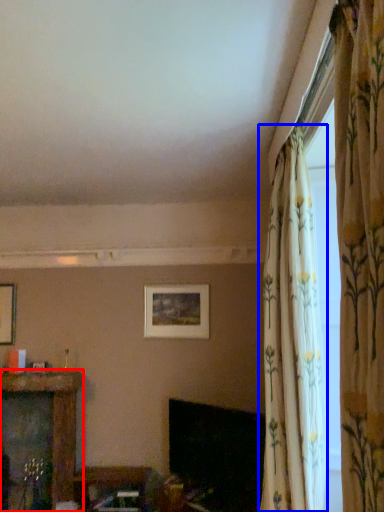
Question: Which of the following is the farthest to the observer, furniture (highlighted by a red box) or curtain (highlighted by a blue box)?

Choices:
 (A) furniture
 (B) curtain

Answer: (A)